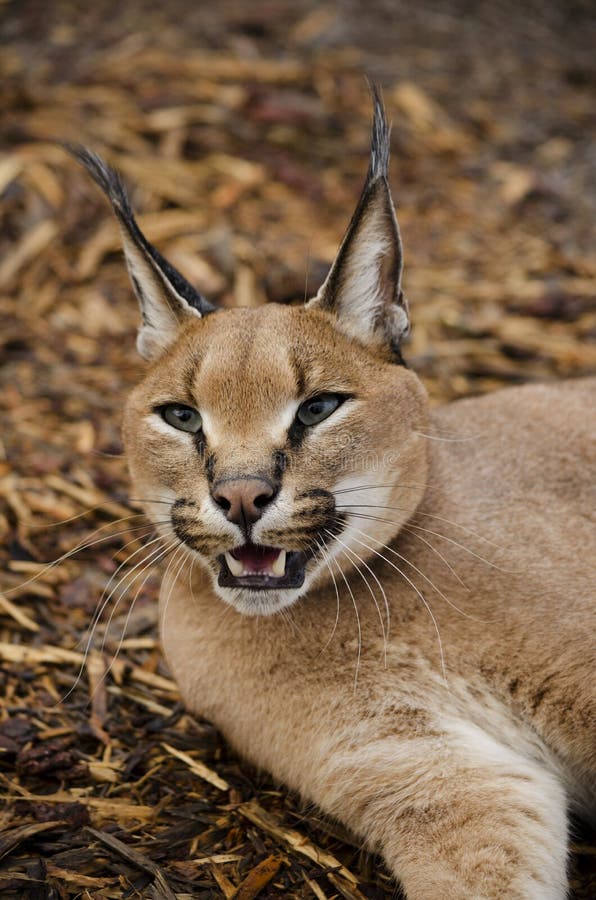
At what (x,y) coordinates should I click in order to perform the action: click on left front leg. Please return your answer as a coordinate pair (x, y). This screenshot has width=596, height=900. Looking at the image, I should click on (439, 814).